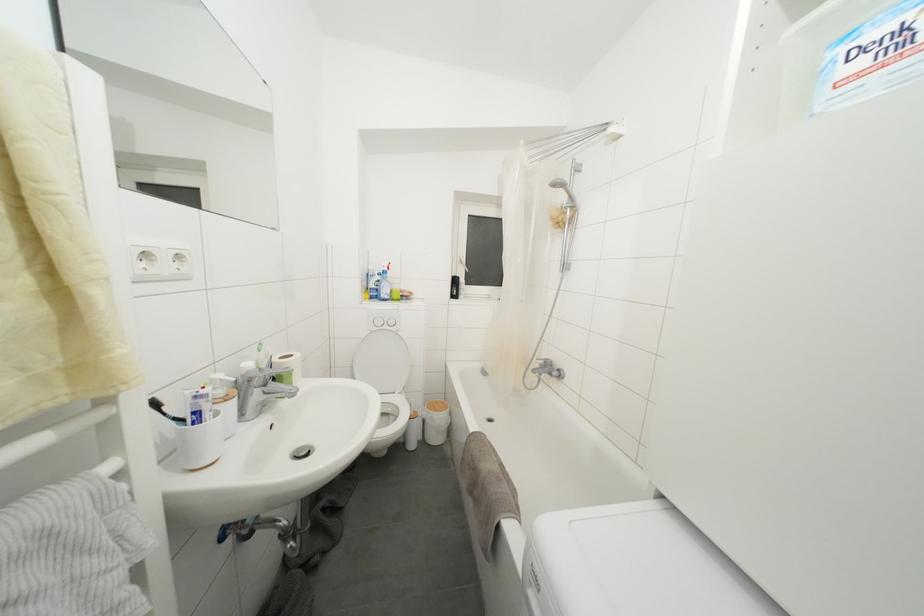
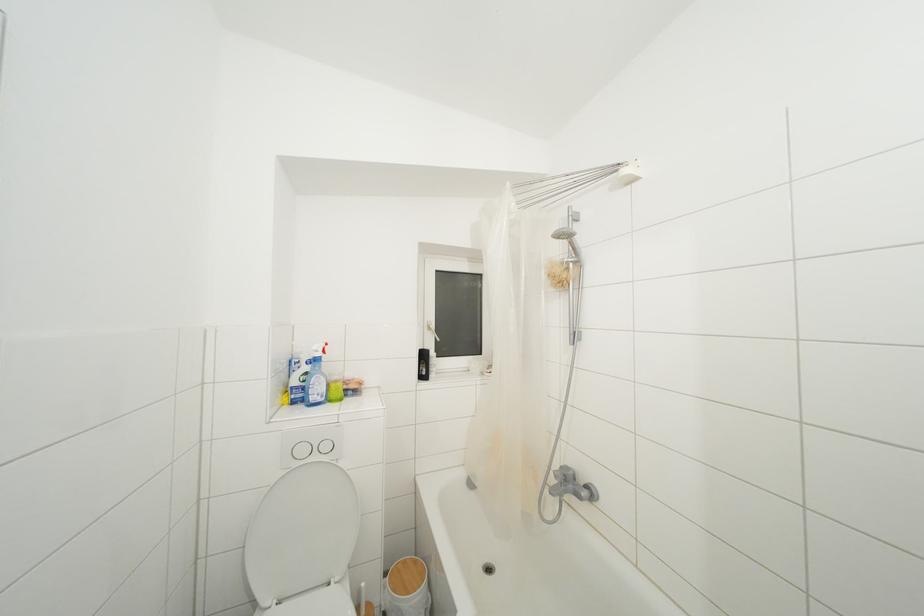
Find the pixel in the second image that matches [419,416] in the first image.

(371, 610)